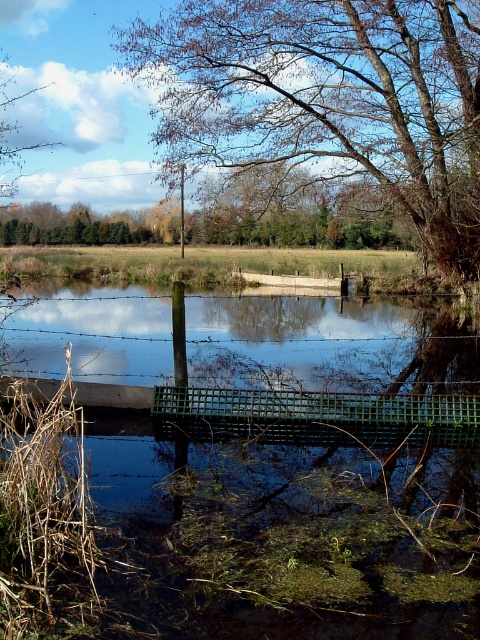
Question: Which of the following is the farthest from the observer?

Choices:
 (A) green plastic bridge at center
 (B) brown leafy tree at upper center
 (C) green mesh bridge at center

Answer: (B)

Question: Can you confirm if green plastic bridge at center is thinner than brown leafy tree at upper center?

Choices:
 (A) no
 (B) yes

Answer: (A)

Question: Can you confirm if green plastic bridge at center is bigger than green mesh bridge at center?

Choices:
 (A) yes
 (B) no

Answer: (A)

Question: Among these objects, which one is farthest from the camera?

Choices:
 (A) green mesh bridge at center
 (B) green plastic bridge at center
 (C) brown leafy tree at upper center

Answer: (C)

Question: Is brown leafy tree at upper center further to the viewer compared to green mesh bridge at center?

Choices:
 (A) no
 (B) yes

Answer: (B)

Question: Which is nearer to the brown leafy tree at upper center?

Choices:
 (A) green plastic bridge at center
 (B) green mesh bridge at center

Answer: (A)